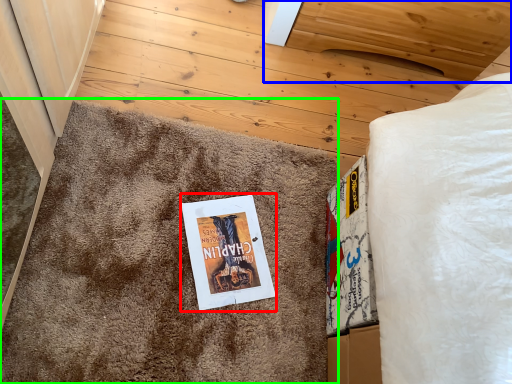
Question: Estimate the real-world distances between objects in this image. Which object is closer to fiction book (highlighted by a red box), furniture (highlighted by a blue box) or doormat (highlighted by a green box)?

Choices:
 (A) furniture
 (B) doormat

Answer: (B)